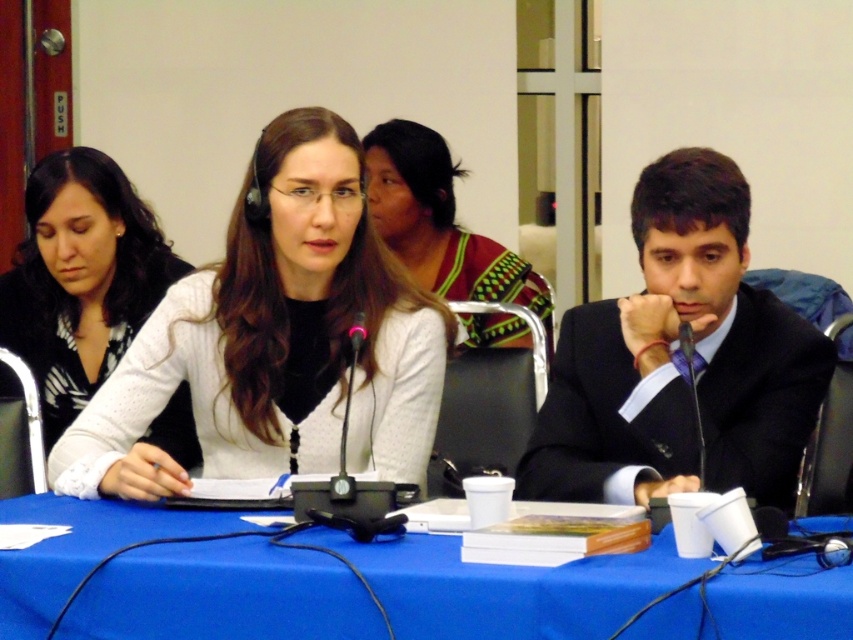
Based on the scene description, which object is taller, the white matte sweater at center or the black suit at right?

The white matte sweater at center is taller than the black suit at right according to the description.

You are a photographer standing 5 feet away from the white matte sweater at center. You want to take a photo of the camera that is 6.40 feet away from the sweater. Can you adjust your position so that the camera is in focus without moving the camera or the sweater?

The camera is 6.40 feet away from the white matte sweater at center. Since you are currently 5 feet away from the sweater, you need to move forward 1.40 feet closer to the sweater to be 6.40 feet away from the camera. However, this might not be necessary if your camera lens can adjust focus at that distance. Alternatively, you can stay at 5 feet and use the autofocus feature to ensure the camera is in focus without needing to move closer.

Based on the scene description, which item is located to the left of the other between the white matte sweater at center and the patterned fabric top at center?

The white matte sweater at center is positioned on the left side of the patterned fabric top at center.